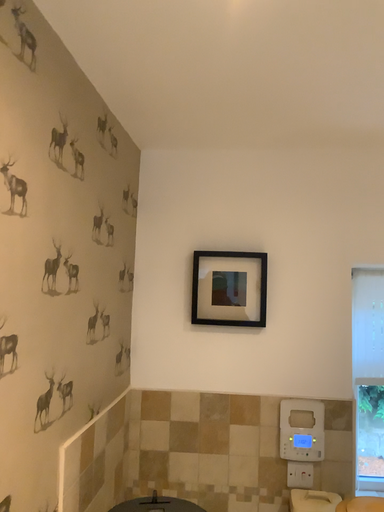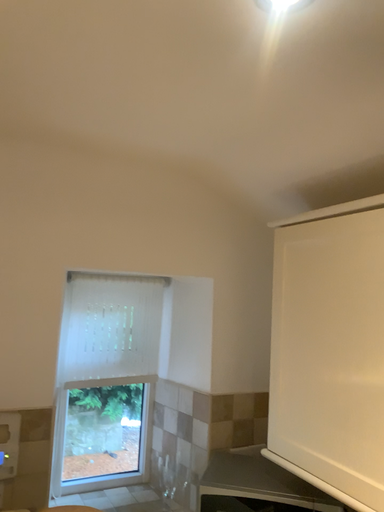
Question: How did the camera likely rotate when shooting the video?

Choices:
 (A) rotated right
 (B) rotated left

Answer: (A)